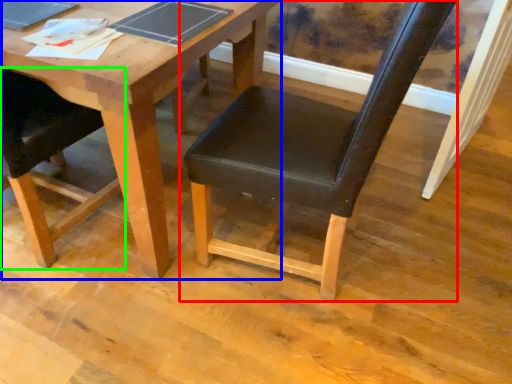
Question: Considering the real-world distances, which object is closest to chair (highlighted by a red box)? table (highlighted by a blue box) or chair (highlighted by a green box).

Choices:
 (A) table
 (B) chair

Answer: (A)